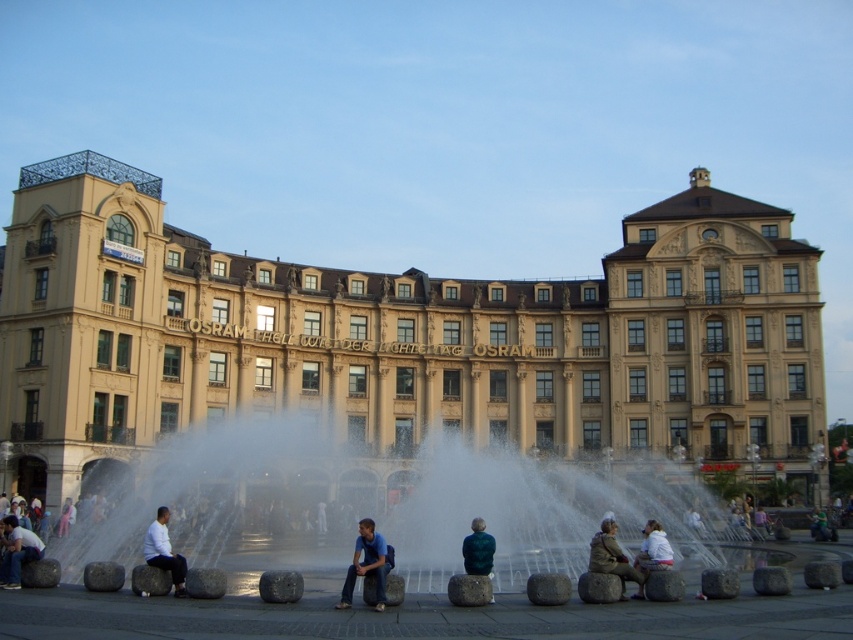
Question: Based on their relative distances, which object is nearer to the white matte shirt at lower left?

Choices:
 (A) beige stone building at center
 (B) white stone fountain at center

Answer: (B)

Question: Among these points, which one is farthest from the camera?

Choices:
 (A) (624, 580)
 (B) (434, 452)
 (C) (20, 541)
 (D) (148, 548)

Answer: (B)

Question: Does white matte shirt at lower left have a smaller size compared to white cotton shirt at center?

Choices:
 (A) no
 (B) yes

Answer: (B)

Question: Which of the following is the farthest from the observer?

Choices:
 (A) [637, 536]
 (B) [468, 557]
 (C) [602, 532]

Answer: (A)

Question: Is white stone fountain at center closer to the viewer compared to white matte shirt at lower left?

Choices:
 (A) no
 (B) yes

Answer: (B)

Question: In this image, where is brown leather jacket at lower right located relative to white cotton shirt at center?

Choices:
 (A) right
 (B) left

Answer: (B)